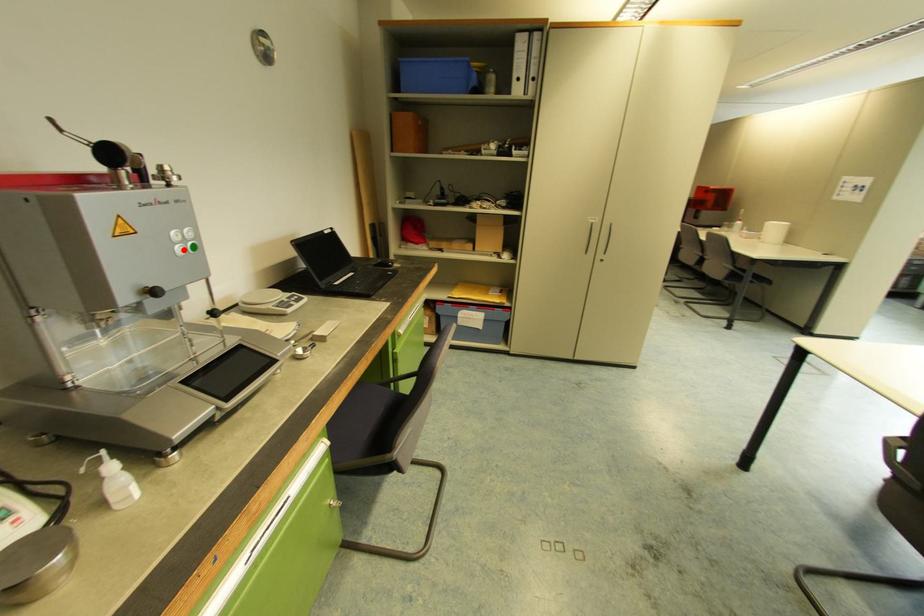
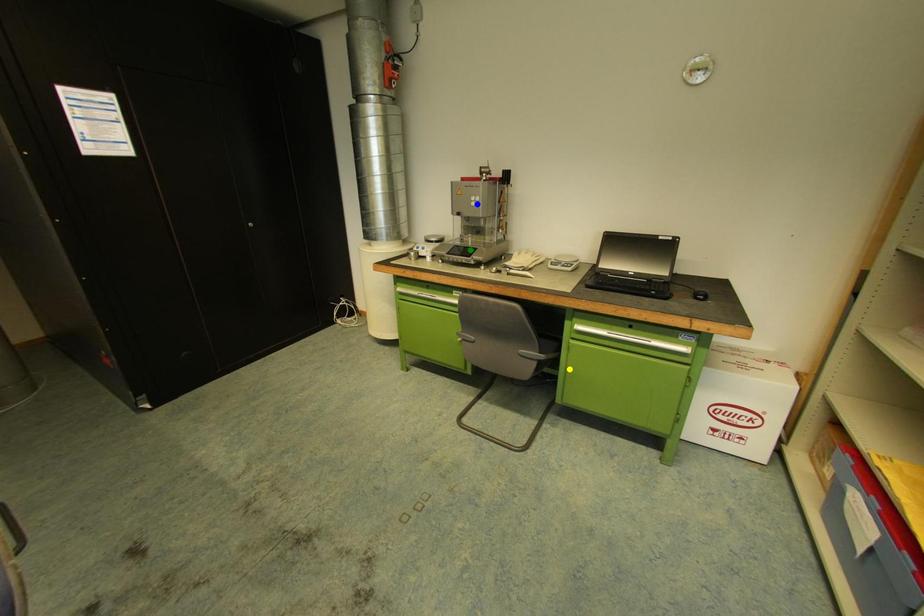
Question: I am providing you with two images of the same scene from different viewpoints. A red point is marked on the first image. You are given multiple points on the second image. Which mark in image 2 goes with the point in image 1?

Choices:
 (A) blue point
 (B) yellow point
 (C) green point

Answer: (A)